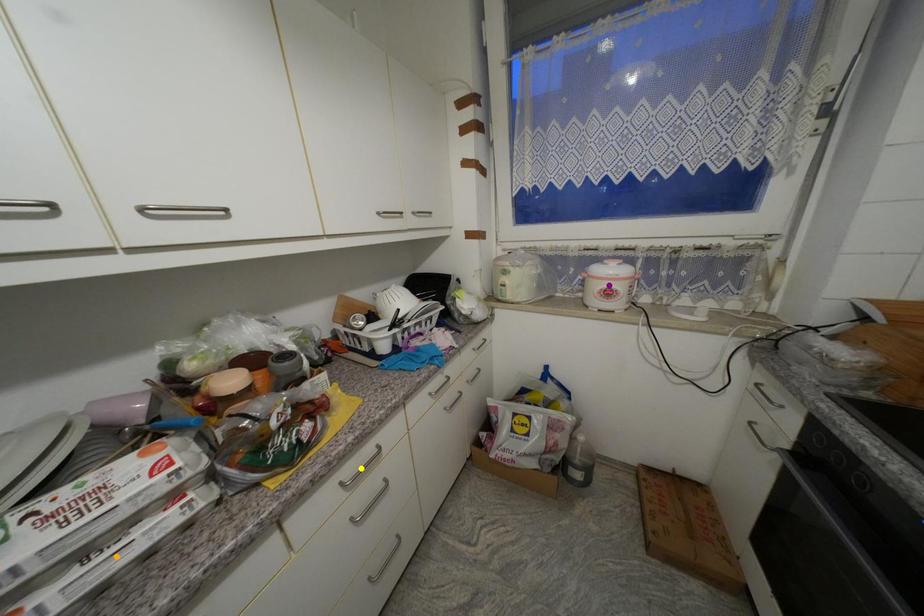
Order these from nearest to farthest:
A) yellow point
B) orange point
C) purple point

orange point
yellow point
purple point